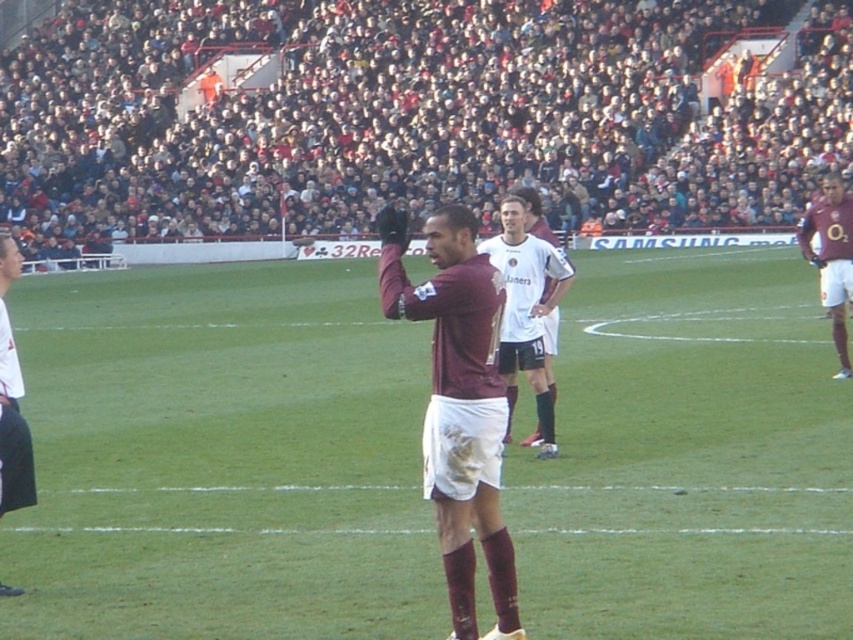
You are a photographer standing at the center of the soccer field. You want to take a photo of the two points marked in the image. Which point, point (370, 100) or point (534, 394), will appear closer to the camera in your photo?

Point (370, 100) is further to the camera than point (534, 394), so in the photo, point (370, 100) will appear closer to the camera than point (534, 394).

You are a drone operator trying to capture the soccer match. The drone is currently at position coordinates of 0.3, 0.5. You need to adjust the drone to focus on the dark red fabric crowd at upper center. Should you move the drone to the left or right? Explain your reasoning based on the coordinates provided.

The dark red fabric crowd at upper center is located at coordinates point (416, 116). The drone is at (426, 192). Since the x coordinate of the crowd is lower than the drone, you should move the drone to the left to focus on the dark red fabric crowd at upper center.